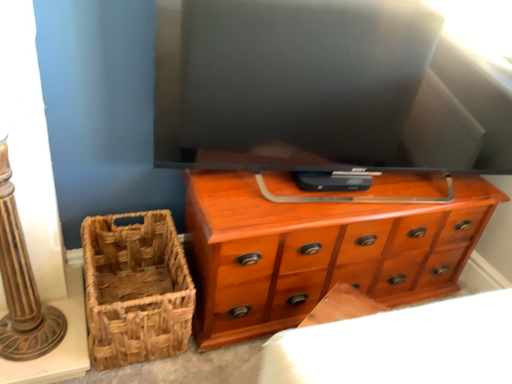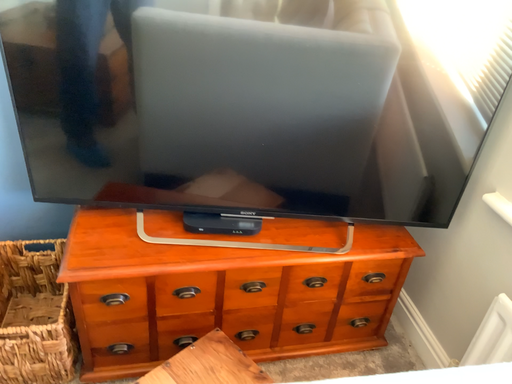
Question: Which way did the camera rotate in the video?

Choices:
 (A) rotated left
 (B) rotated right

Answer: (A)